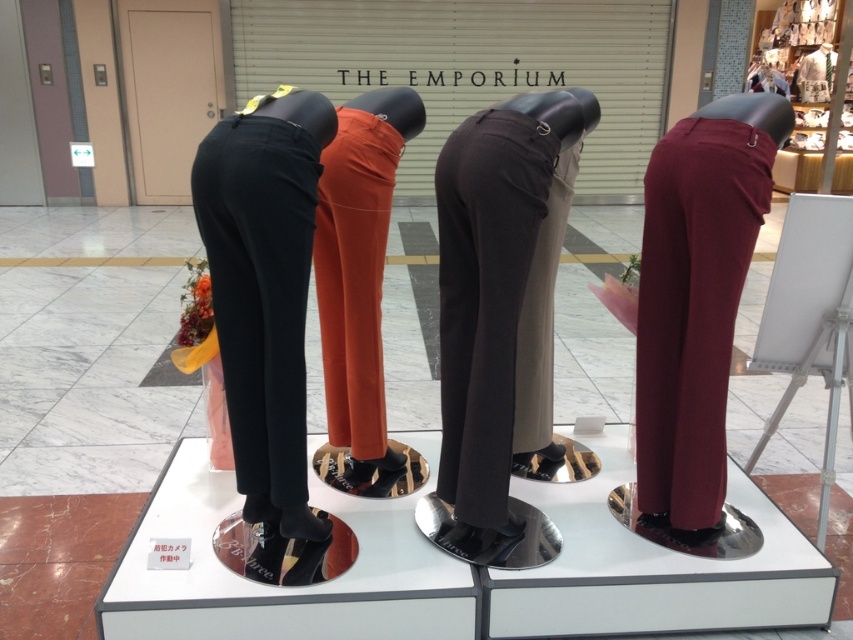
Does burgundy smooth pants at right lie behind dark gray trousers at center?

Yes, it is behind dark gray trousers at center.

Which of these two, burgundy smooth pants at right or dark gray trousers at center, stands shorter?

Standing shorter between the two is dark gray trousers at center.

Locate an element on the screen. The width and height of the screenshot is (853, 640). burgundy smooth pants at right is located at coordinates (693, 307).

From the picture: Is matte black trousers at left wider than dark gray trousers at center?

Correct, the width of matte black trousers at left exceeds that of dark gray trousers at center.

Does matte black trousers at left come behind dark gray trousers at center?

No.

Describe the element at coordinates (260, 292) in the screenshot. I see `matte black trousers at left` at that location.

Where is `matte black trousers at left`? matte black trousers at left is located at coordinates (260, 292).

Does dark gray trousers at center come behind orange cotton pants at center?

No, dark gray trousers at center is in front of orange cotton pants at center.

Can you confirm if dark gray trousers at center is taller than orange cotton pants at center?

No, dark gray trousers at center is not taller than orange cotton pants at center.

Where is `dark gray trousers at center`? The image size is (853, 640). dark gray trousers at center is located at coordinates (485, 298).